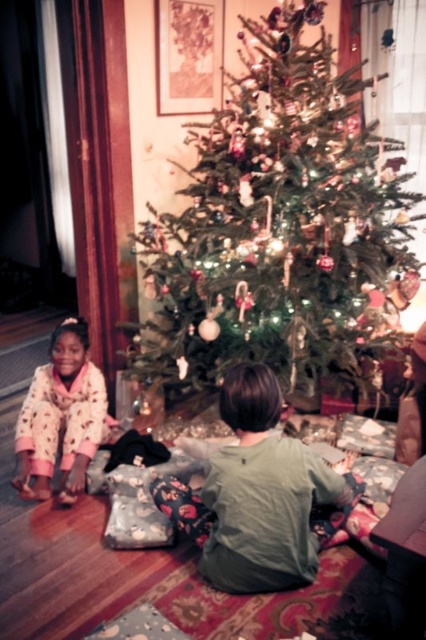
You are a parent trying to locate two points in the image. The first point is at coordinates point (224, 269) and the second is at point (43, 435). Which point is closer to you?

Point (224, 269) is further to the viewer than point (43, 435), so the second point is closer to you.